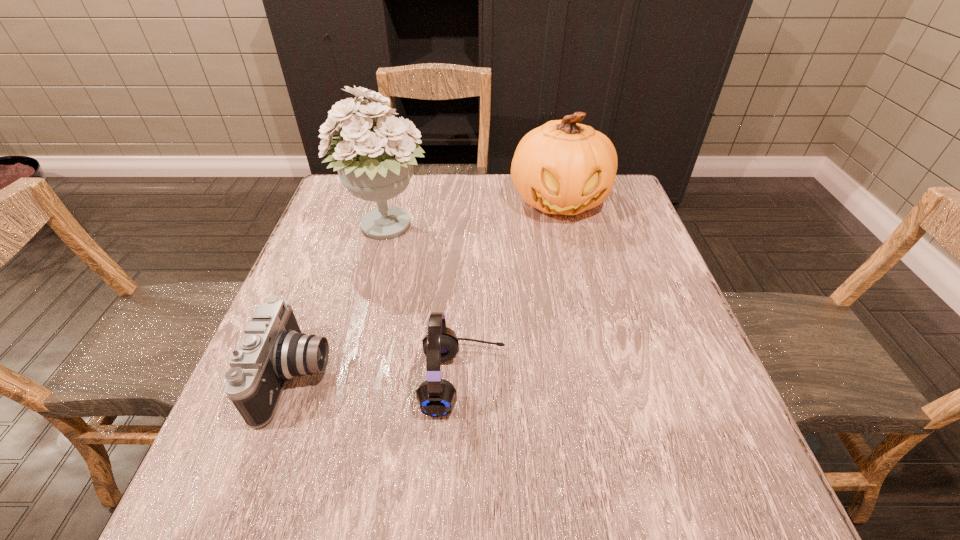
Identify the location of free space at the far right corner of the desktop. The width and height of the screenshot is (960, 540). (602, 207).

Locate an element on the screen. Image resolution: width=960 pixels, height=540 pixels. empty space between the second object from right to left and the tallest object is located at coordinates (x=425, y=304).

The image size is (960, 540). In order to click on free space between the headset and the camera in this screenshot , I will do `click(380, 379)`.

The image size is (960, 540). I want to click on free space between the tallest object and the headset, so click(x=425, y=304).

At what (x,y) coordinates should I click in order to perform the action: click on vacant area that lies between the rightmost object and the camera. Please return your answer as a coordinate pair (x, y). Looking at the image, I should click on (428, 288).

Find the location of a particular element. The image size is (960, 540). free space between the tallest object and the headset is located at coordinates (425, 304).

The height and width of the screenshot is (540, 960). Find the location of `vacant space in between the tallest object and the camera`. vacant space in between the tallest object and the camera is located at coordinates (342, 302).

At what (x,y) coordinates should I click in order to perform the action: click on free space between the tallest object and the pumpkin. Please return your answer as a coordinate pair (x, y). This screenshot has width=960, height=540. Looking at the image, I should click on (473, 214).

The height and width of the screenshot is (540, 960). Find the location of `free space that is in between the bouquet and the rightmost object`. free space that is in between the bouquet and the rightmost object is located at coordinates (473, 214).

Identify the location of free space between the bouquet and the rightmost object. (473, 214).